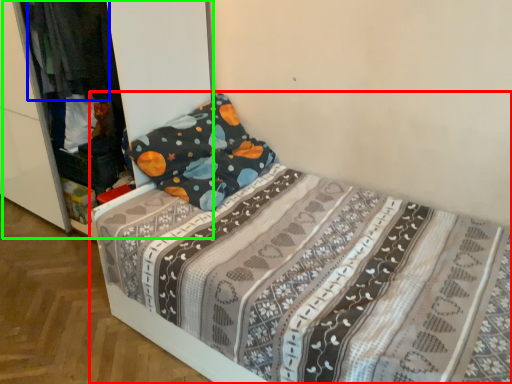
Question: Which object is the farthest from bed (highlighted by a red box)? Choose among these: clothing (highlighted by a blue box) or dresser (highlighted by a green box).

Choices:
 (A) clothing
 (B) dresser

Answer: (B)